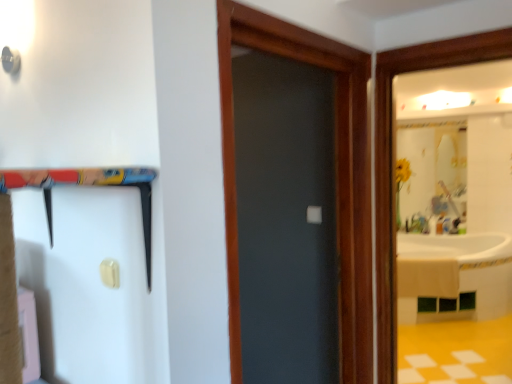
Question: In terms of width, does matte gray door at center look wider or thinner when compared to white plastic barn door at upper left?

Choices:
 (A) wide
 (B) thin

Answer: (B)

Question: Considering the positions of matte gray door at center and white plastic barn door at upper left in the image, is matte gray door at center bigger or smaller than white plastic barn door at upper left?

Choices:
 (A) small
 (B) big

Answer: (A)

Question: In terms of height, does matte gray door at center look taller or shorter compared to white plastic barn door at upper left?

Choices:
 (A) tall
 (B) short

Answer: (A)

Question: Considering the positions of white plastic barn door at upper left and matte gray door at center in the image, is white plastic barn door at upper left bigger or smaller than matte gray door at center?

Choices:
 (A) small
 (B) big

Answer: (B)

Question: Is white plastic barn door at upper left to the left or to the right of matte gray door at center in the image?

Choices:
 (A) left
 (B) right

Answer: (A)

Question: Considering the positions of point tap(142, 198) and point tap(362, 306), is point tap(142, 198) closer or farther from the camera than point tap(362, 306)?

Choices:
 (A) farther
 (B) closer

Answer: (B)

Question: Is white plastic barn door at upper left spatially inside matte gray door at center, or outside of it?

Choices:
 (A) outside
 (B) inside

Answer: (A)